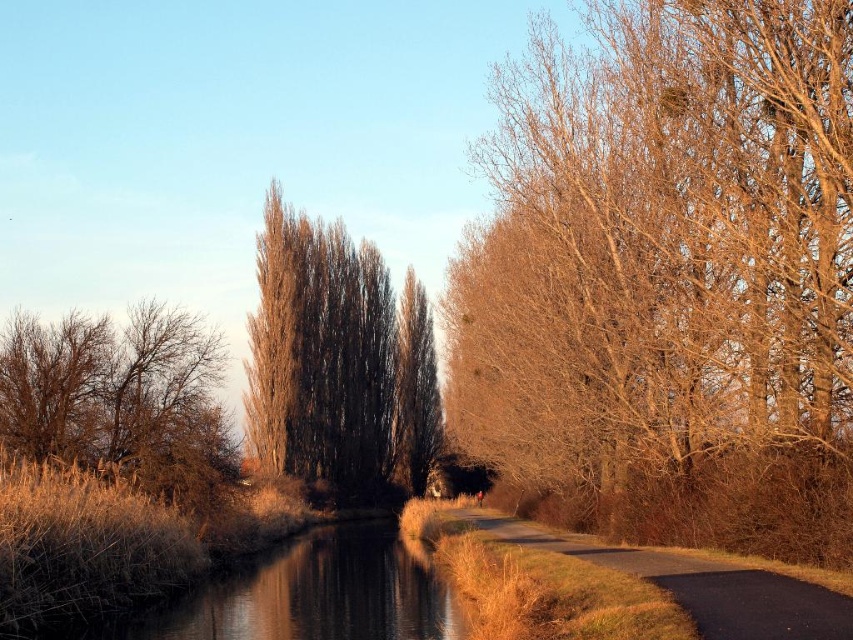
Question: Estimate the real-world distances between objects in this image. Which object is farther from the brown/dry wood trees at center?

Choices:
 (A) brown grassy river at center
 (B) dark asphalt road at center

Answer: (B)

Question: Can you confirm if brown textured tree at right is positioned above brown textured tree at left?

Choices:
 (A) no
 (B) yes

Answer: (B)

Question: Which of the following is the closest to the observer?

Choices:
 (A) dark asphalt road at center
 (B) brown/dry wood trees at center
 (C) brown textured tree at left

Answer: (A)

Question: Is brown/dry wood trees at center positioned at the back of brown textured tree at left?

Choices:
 (A) yes
 (B) no

Answer: (A)

Question: Among these objects, which one is nearest to the camera?

Choices:
 (A) brown grassy river at center
 (B) brown/dry wood trees at center
 (C) brown textured tree at left
 (D) brown textured tree at right

Answer: (D)

Question: Does brown textured tree at left come in front of dark asphalt road at center?

Choices:
 (A) yes
 (B) no

Answer: (B)